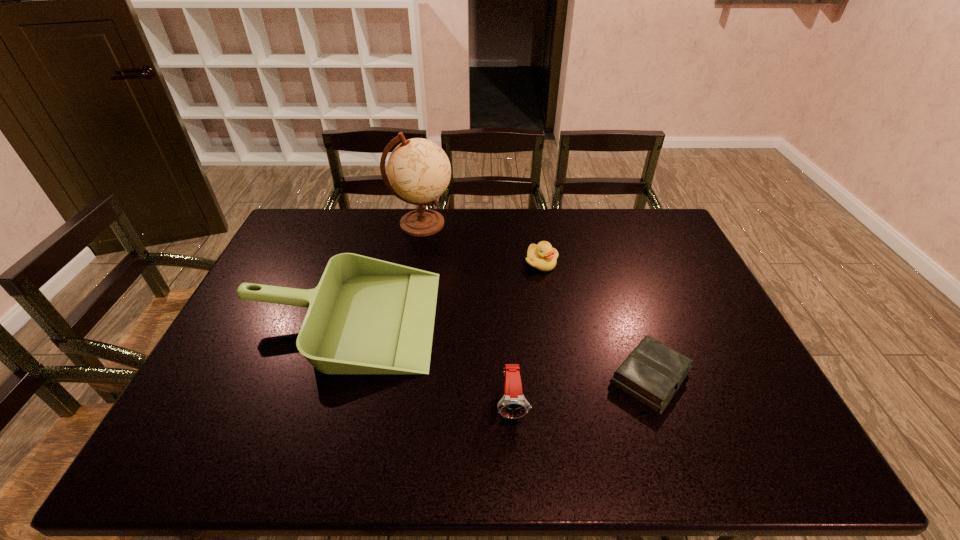
This screenshot has width=960, height=540. In order to click on the tallest object in this screenshot , I will do `click(419, 171)`.

Identify the location of the farthest object. (419, 171).

I want to click on dustpan, so click(x=366, y=316).

Identify the location of the third object from right to left. (513, 405).

Where is `duckling`? duckling is located at coordinates (543, 257).

Where is `the fourth object from left to right`? Image resolution: width=960 pixels, height=540 pixels. the fourth object from left to right is located at coordinates (543, 257).

What are the coordinates of `book` in the screenshot? It's located at (652, 373).

The height and width of the screenshot is (540, 960). I want to click on the shortest object, so click(652, 373).

Find the location of `vacant space located on the surface of the globe`. vacant space located on the surface of the globe is located at coordinates (492, 224).

In order to click on vacant space located 0.360m on the scoop of the dustpan in this screenshot , I will do `click(560, 319)`.